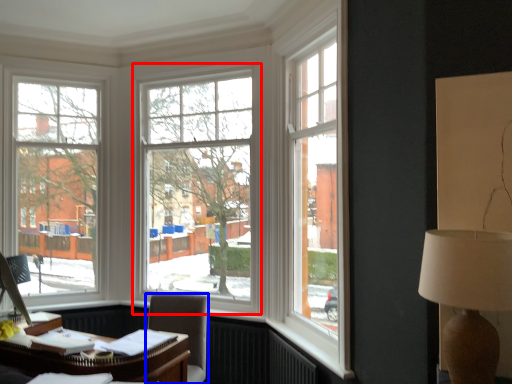
Question: Which object is closer to the camera taking this photo, window (highlighted by a red box) or chair (highlighted by a blue box)?

Choices:
 (A) window
 (B) chair

Answer: (B)